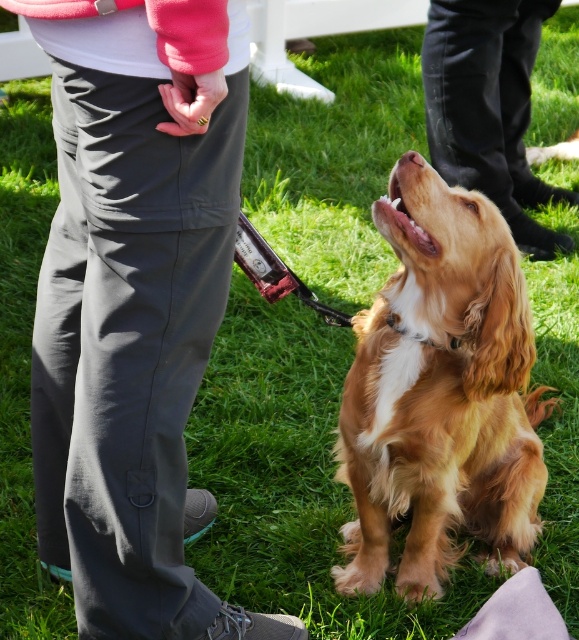
You are a photographer trying to capture the golden fur dog at center. If your camera is positioned at the origin point, which direction should you move to get a better shot of the dog?

The golden fur dog at center is located at point [441,394], so you should move towards the upper right direction to get a better shot of the dog.

You are a photographer standing at the edge of the grassy area. You want to take a photo of the golden fur dog at center and the black smooth pants at center. Based on their heights, which one will appear closer to the ground in the photo?

The golden fur dog at center is shorter than the black smooth pants at center, so the golden fur dog at center will appear closer to the ground in the photo.